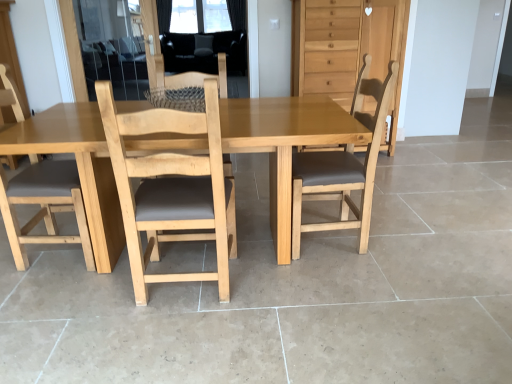
Question: Is light brown wood chair at left, which is the third chair from right to left, inside the boundaries of transparent glass screen door at upper left, or outside?

Choices:
 (A) inside
 (B) outside

Answer: (B)

Question: Considering their positions, is light brown wood chair at left, which is the third chair from right to left, located in front of or behind transparent glass screen door at upper left?

Choices:
 (A) front
 (B) behind

Answer: (A)

Question: Estimate the real-world distances between objects in this image. Which object is closer to the light brown wood chair at left, positioned as the 2th chair in left-to-right order?

Choices:
 (A) transparent glass screen door at upper left
 (B) light brown wooden dresser at upper right
 (C) light wood chair at center, acting as the 2th chair starting from the right
 (D) light brown wood chair at center, which is the 4th chair in left-to-right order
 (E) light brown wooden table at center

Answer: (E)

Question: Which object is the closest to the light wood chair at center, which is counted as the third chair, starting from the left?

Choices:
 (A) transparent glass screen door at upper left
 (B) light brown wood chair at left, acting as the fourth chair starting from the right
 (C) light brown wood chair at center, which ranks as the 1th chair in right-to-left order
 (D) light brown wooden dresser at upper right
 (E) light brown wood chair at left, which is the third chair from right to left

Answer: (E)